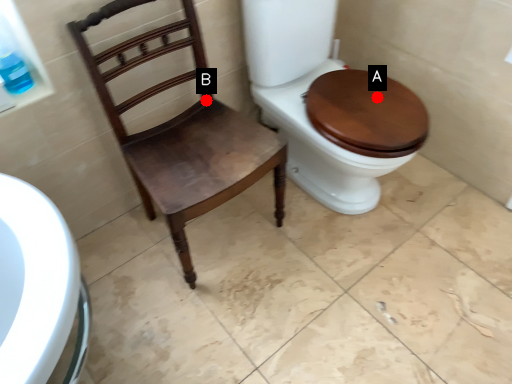
Question: Two points are circled on the image, labeled by A and B beside each circle. Which point is closer to the camera taking this photo?

Choices:
 (A) A is closer
 (B) B is closer

Answer: (A)